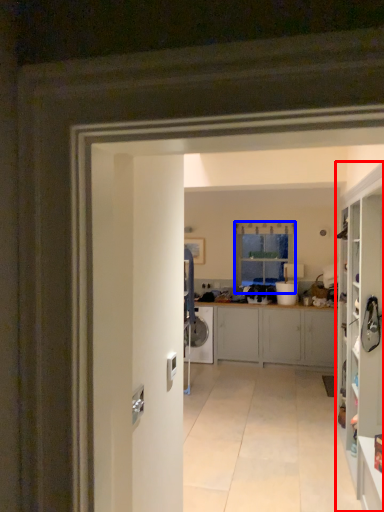
Question: Which of the following is the closest to the observer, cabinetry (highlighted by a red box) or window (highlighted by a blue box)?

Choices:
 (A) cabinetry
 (B) window

Answer: (A)